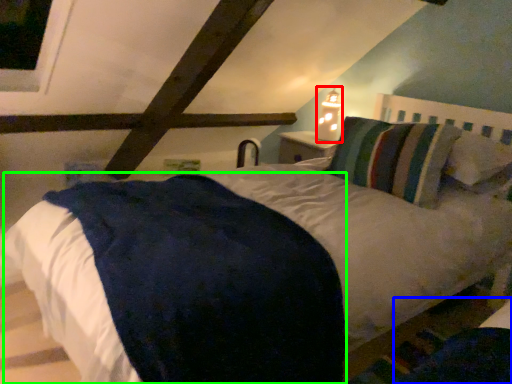
Question: Which object is the farthest from bedside lamp (highlighted by a red box)? Choose among these: dark (highlighted by a blue box) or mattress (highlighted by a green box).

Choices:
 (A) dark
 (B) mattress

Answer: (A)